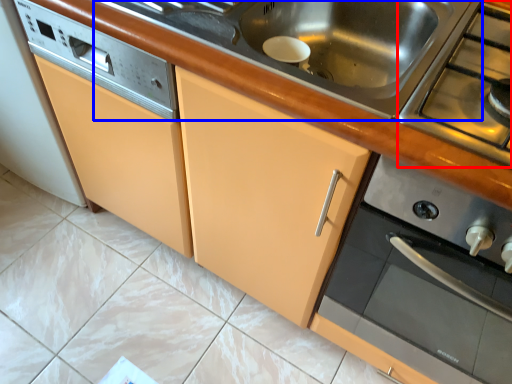
Question: Which point is further to the camera, gas stove (highlighted by a red box) or sink (highlighted by a blue box)?

Choices:
 (A) gas stove
 (B) sink

Answer: (B)